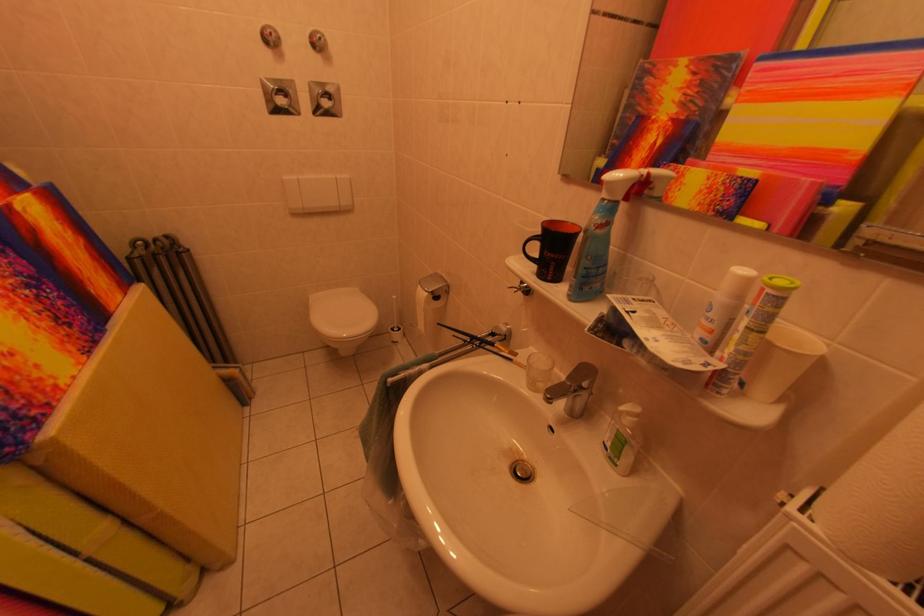
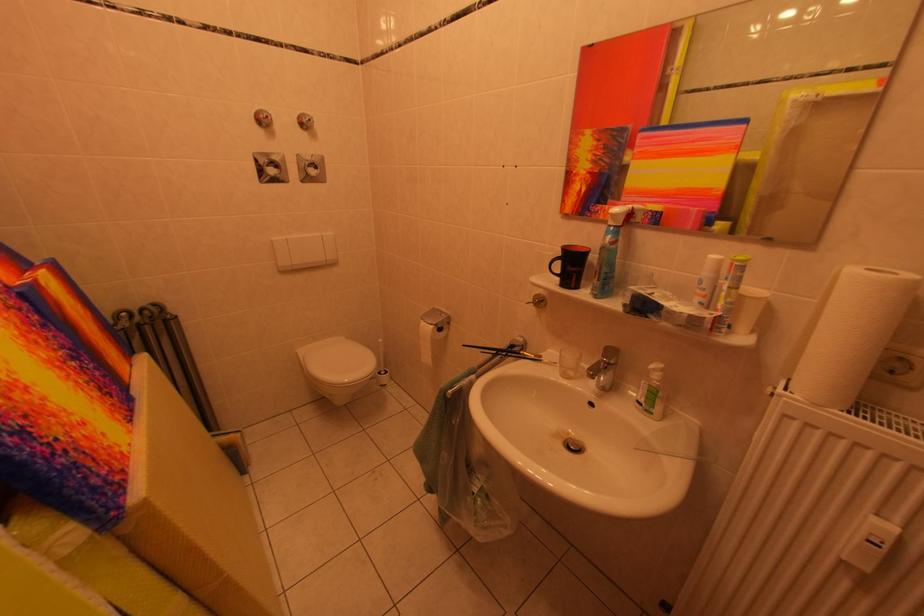
The point at (578, 382) is marked in the first image. Where is the corresponding point in the second image?

(612, 360)